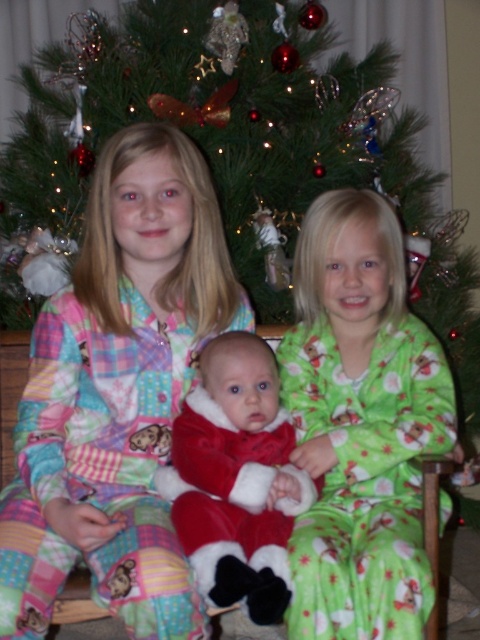
Is green flannel pajamas at center smaller than velvet red santa suit at center?

No.

Who is taller, green flannel pajamas at center or velvet red santa suit at center?

With more height is green flannel pajamas at center.

Does point (358, 321) come behind point (236, 568)?

Yes, point (358, 321) is behind point (236, 568).

This screenshot has width=480, height=640. Identify the location of green flannel pajamas at center. (360, 424).

Does patchwork pajamas at center have a greater height compared to velvet red santa suit at center?

Yes, patchwork pajamas at center is taller than velvet red santa suit at center.

The width and height of the screenshot is (480, 640). I want to click on patchwork pajamas at center, so click(118, 394).

Looking at this image, between patchwork pajamas at center and green flannel pajamas at center, which one is positioned higher?

Positioned higher is patchwork pajamas at center.

This screenshot has height=640, width=480. Find the location of `patchwork pajamas at center`. patchwork pajamas at center is located at coordinates [118, 394].